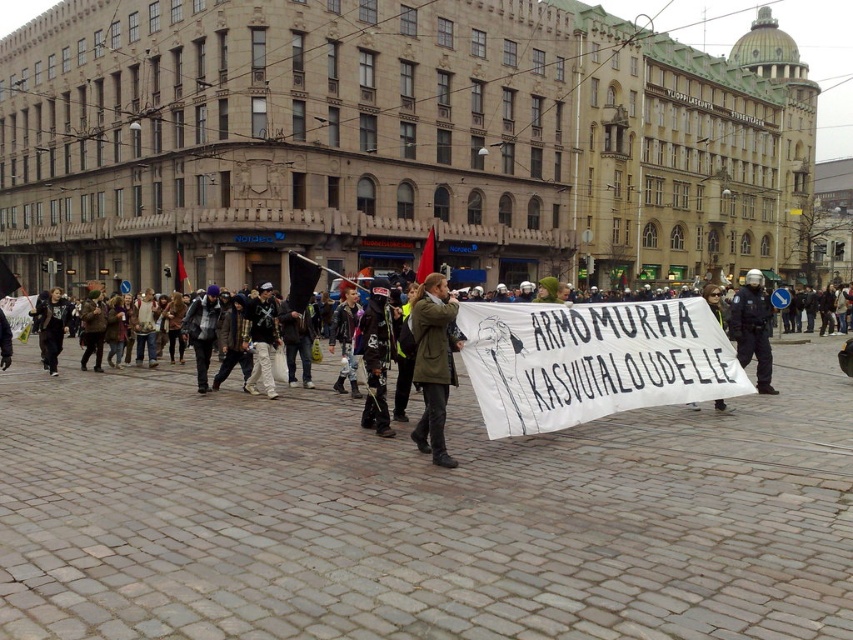
Question: Observing the image, what is the correct spatial positioning of green matte coat at center in reference to matte black helmet at center?

Choices:
 (A) below
 (B) above

Answer: (A)

Question: Does green matte coat at center lie in front of matte black helmet at center?

Choices:
 (A) yes
 (B) no

Answer: (A)

Question: Among these objects, which one is nearest to the camera?

Choices:
 (A) matte black helmet at center
 (B) green matte coat at center

Answer: (B)

Question: Which of the following is the closest to the observer?

Choices:
 (A) (740, 305)
 (B) (439, 442)

Answer: (B)

Question: Is green matte coat at center closer to the viewer compared to matte black helmet at center?

Choices:
 (A) no
 (B) yes

Answer: (B)